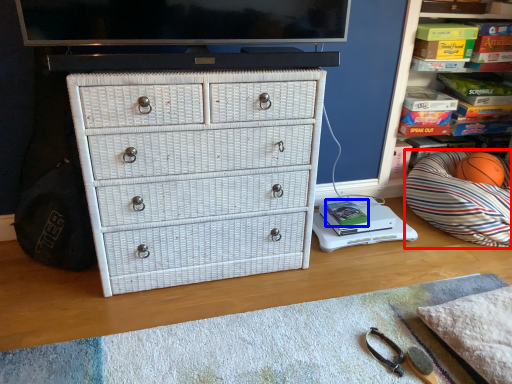
Question: Which object appears farthest to the camera in this image, throw pillow (highlighted by a red box) or book (highlighted by a blue box)?

Choices:
 (A) throw pillow
 (B) book

Answer: (B)